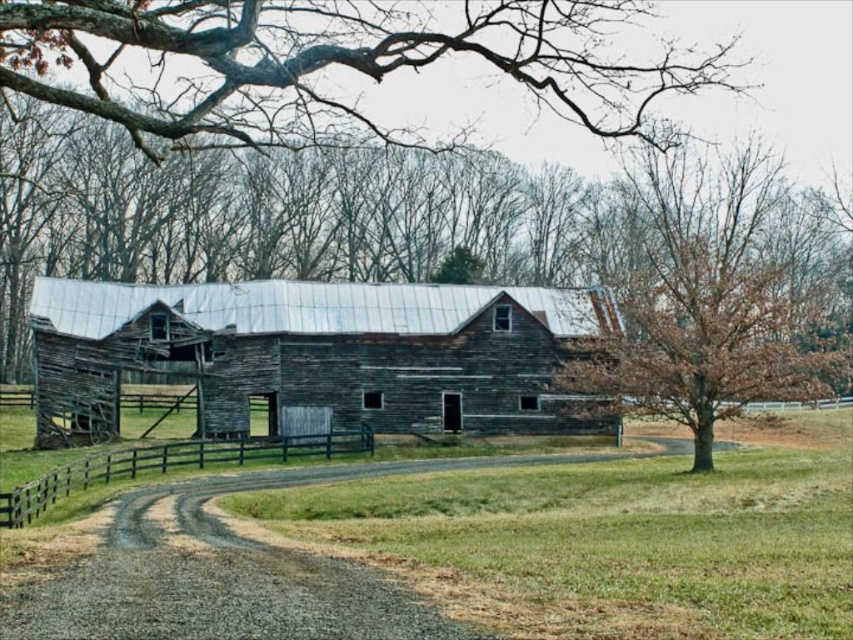
Question: Is weathered wood barn at center closer to the viewer compared to gray gravel road at lower left?

Choices:
 (A) no
 (B) yes

Answer: (A)

Question: Among these objects, which one is farthest from the camera?

Choices:
 (A) bare branches at upper center
 (B) gray gravel road at lower left

Answer: (A)

Question: Which point is farther to the camera?

Choices:
 (A) brown textured tree at right
 (B) black wooden fence at lower center
 (C) weathered wood barn at center
 (D) gray gravel road at lower left

Answer: (C)

Question: Is bare branches at upper center smaller than gray gravel road at lower left?

Choices:
 (A) no
 (B) yes

Answer: (A)

Question: Among these objects, which one is nearest to the camera?

Choices:
 (A) black wooden fence at lower center
 (B) brown textured tree at right

Answer: (A)

Question: Is brown textured tree at right positioned in front of gray gravel road at lower left?

Choices:
 (A) yes
 (B) no

Answer: (B)